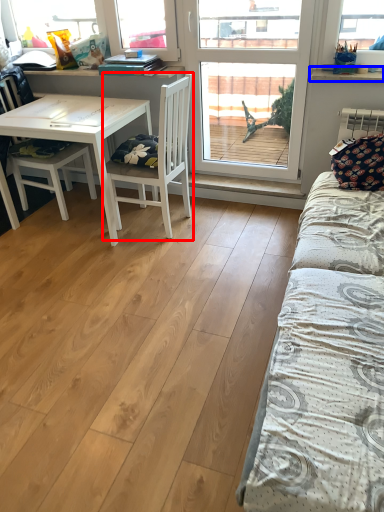
Question: Which object is further to the camera taking this photo, chair (highlighted by a red box) or window sill (highlighted by a blue box)?

Choices:
 (A) chair
 (B) window sill

Answer: (B)